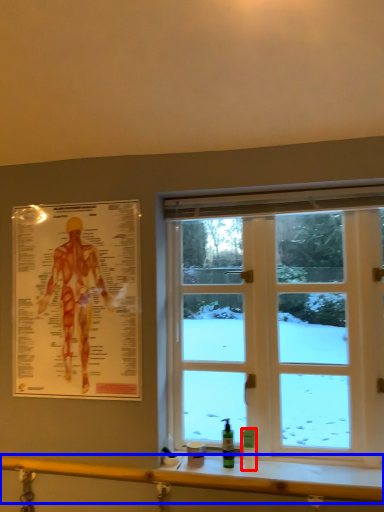
Question: Which object appears farthest to the camera in this image, toiletry (highlighted by a red box) or rail (highlighted by a blue box)?

Choices:
 (A) toiletry
 (B) rail

Answer: (A)